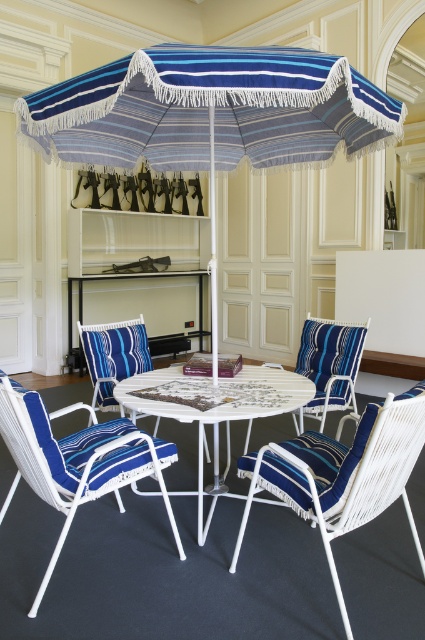
You are sitting in the blue striped fabric armchair at center and want to place a book on the white wicker table at center. In which direction should you move the book to reach the table?

The white wicker table at center is to the right of the blue striped fabric armchair at center, so you should move the book to the right to reach the table.

You are standing in the seating area and want to place a new plant stand exactly where the white wicker table at center is located. What coordinates should you use?

The white wicker table at center is located at coordinates point (214, 406), so you should place the plant stand at those coordinates.

You are sitting in the blue striped cushioned chair at center and want to reach the blue striped fabric umbrella at center. Which direction should you move to get closer to the umbrella?

The blue striped cushioned chair at center is behind the blue striped fabric umbrella at center, so you should move forward to get closer to the umbrella.